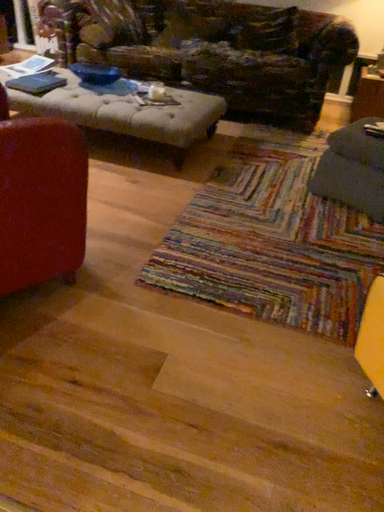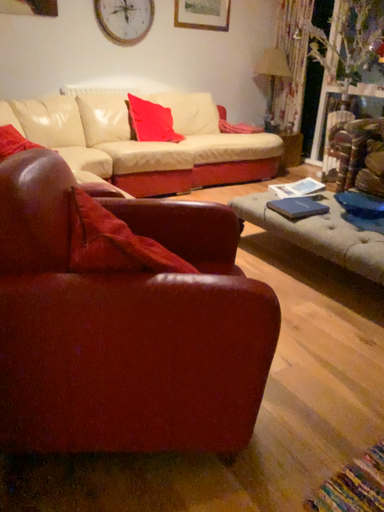
Question: Which way did the camera rotate in the video?

Choices:
 (A) rotated left
 (B) rotated right

Answer: (A)